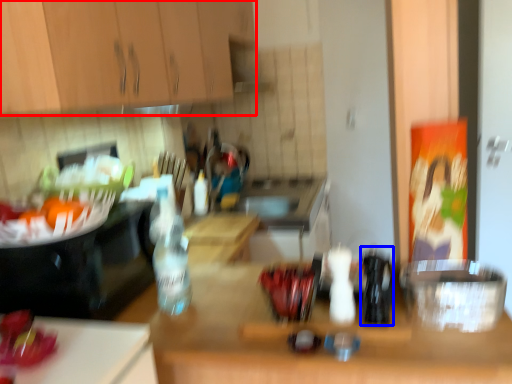
Question: Which object is further to the camera taking this photo, cabinetry (highlighted by a red box) or bottle (highlighted by a blue box)?

Choices:
 (A) cabinetry
 (B) bottle

Answer: (B)